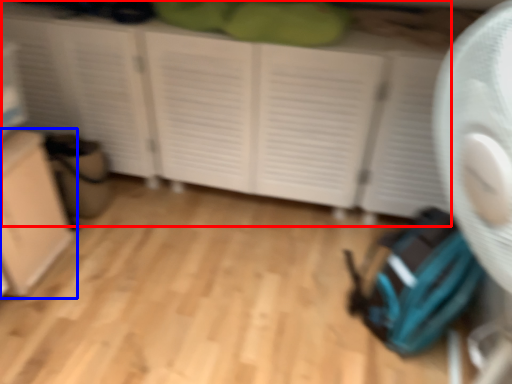
Question: Which point is closer to the camera, cupboard (highlighted by a red box) or cabinetry (highlighted by a blue box)?

Choices:
 (A) cupboard
 (B) cabinetry

Answer: (B)